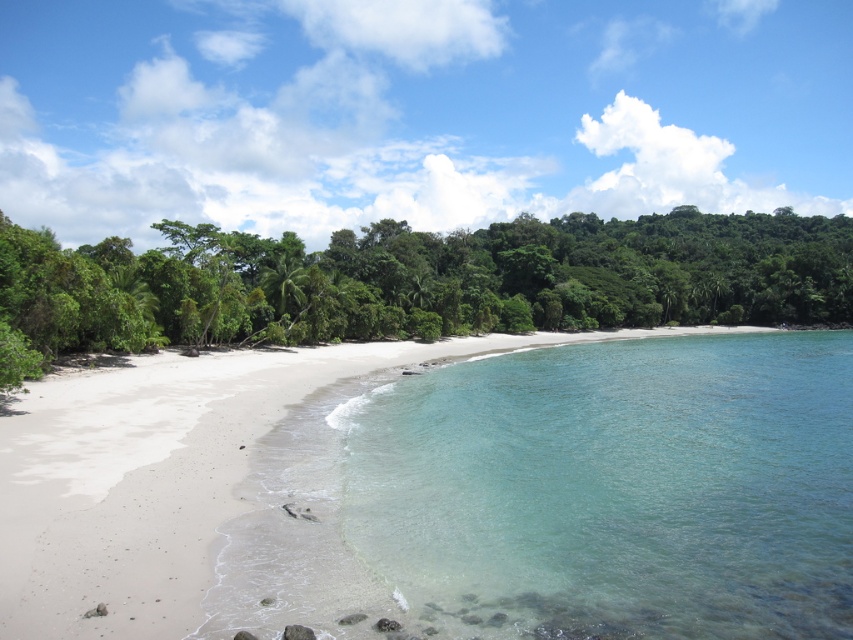
You are a drone operator tasked with capturing aerial footage of the beach. Your drone has a maximum flight range of 100 meters. You need to fly from the clear glassy water at center to the green leafy trees at center. Can your drone complete this flight without needing to return to you before reaching the destination?

The distance between the clear glassy water at center and the green leafy trees at center is 111.90 meters, which exceeds the drone maximum flight range of 100 meters. Therefore, the drone cannot complete the flight without returning.

You are standing on the beach and want to take a photo that includes both the clear glassy water at center and the green leafy trees at center. Which object will appear smaller in the photo?

The clear glassy water at center will appear smaller in the photo because it is smaller than the green leafy trees at center according to the description.